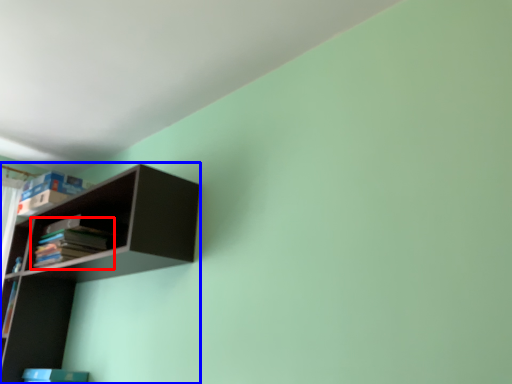
Question: Which object appears farthest to the camera in this image, book (highlighted by a red box) or shelf (highlighted by a blue box)?

Choices:
 (A) book
 (B) shelf

Answer: (A)